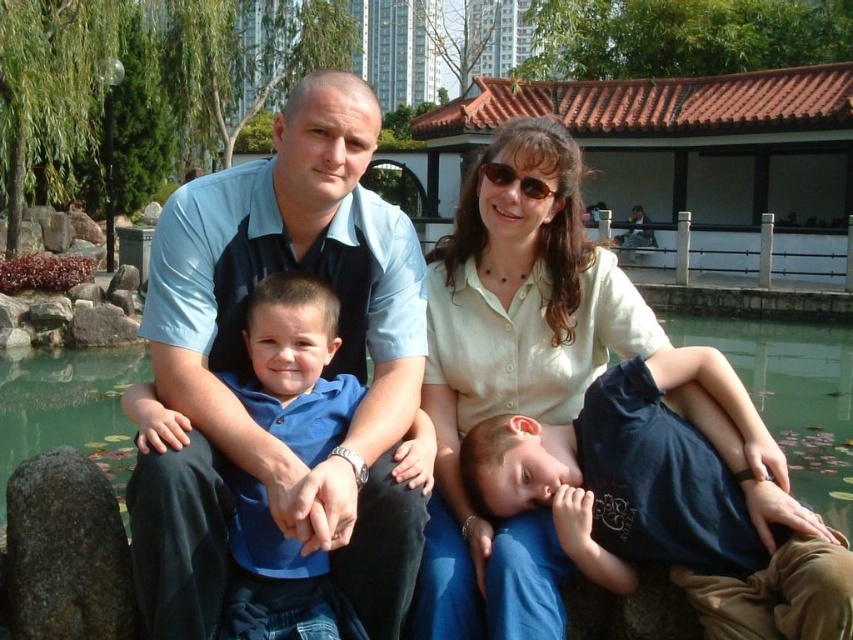
Question: Can you confirm if dark blue cotton shirt at lower right is bigger than green water at lower center?

Choices:
 (A) yes
 (B) no

Answer: (B)

Question: Which of the following is the farthest from the observer?

Choices:
 (A) green water at lower center
 (B) gray rough stone at lower left
 (C) dark blue cotton shirt at lower right

Answer: (A)

Question: Is dark blue cotton shirt at lower right smaller than gray rough stone at lower left?

Choices:
 (A) no
 (B) yes

Answer: (B)

Question: Does blue shirt at center appear under gray rough stone at lower left?

Choices:
 (A) no
 (B) yes

Answer: (A)

Question: Which point is closer to the camera?

Choices:
 (A) gray rough stone at lower left
 (B) blue shirt at center
 (C) green water at lower center
 (D) dark blue cotton shirt at lower right

Answer: (B)

Question: Which point appears farthest from the camera in this image?

Choices:
 (A) (808, 444)
 (B) (679, 538)

Answer: (A)